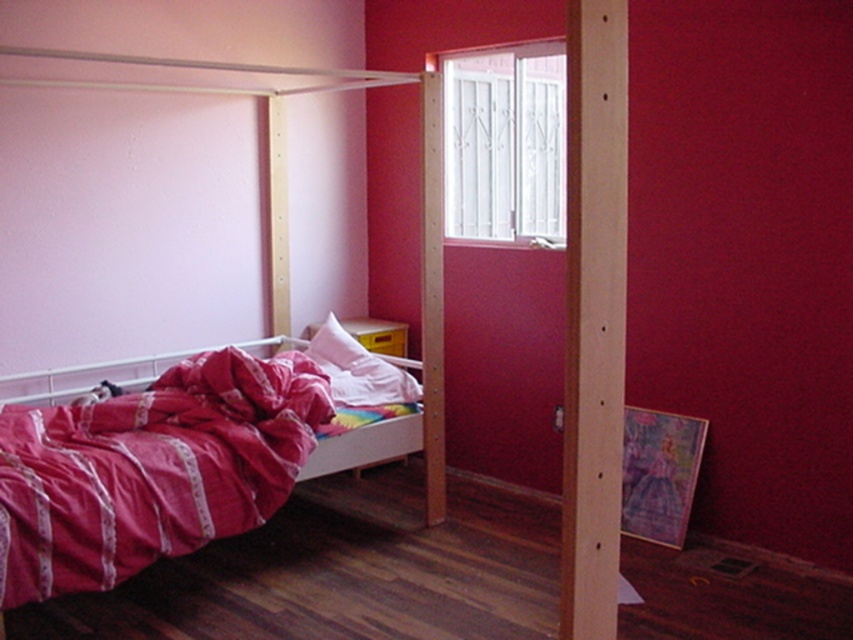
Does point (622, 106) come farther from viewer compared to point (218, 68)?

No.

Image resolution: width=853 pixels, height=640 pixels. I want to click on wooden post at center, so click(x=593, y=316).

Which is behind, point (602, 259) or point (270, 236)?

Positioned behind is point (270, 236).

This screenshot has height=640, width=853. Find the location of `wooden post at center`. wooden post at center is located at coordinates (593, 316).

Is wooden post at center to the right of matte pink pillow at center from the viewer's perspective?

Indeed, wooden post at center is positioned on the right side of matte pink pillow at center.

Who is positioned more to the right, wooden post at center or matte pink pillow at center?

wooden post at center

Image resolution: width=853 pixels, height=640 pixels. What do you see at coordinates (593, 316) in the screenshot? I see `wooden post at center` at bounding box center [593, 316].

Find the location of a particular element. The width and height of the screenshot is (853, 640). wooden post at center is located at coordinates (593, 316).

Is pink satin blanket at lower left in front of white metal window at upper center?

Yes, pink satin blanket at lower left is closer to the viewer.

Does pink satin blanket at lower left appear on the left side of white metal window at upper center?

Correct, you'll find pink satin blanket at lower left to the left of white metal window at upper center.

Is point (206, 444) closer to camera compared to point (503, 138)?

Yes.

This screenshot has width=853, height=640. In order to click on pink satin blanket at lower left in this screenshot , I will do `click(151, 468)`.